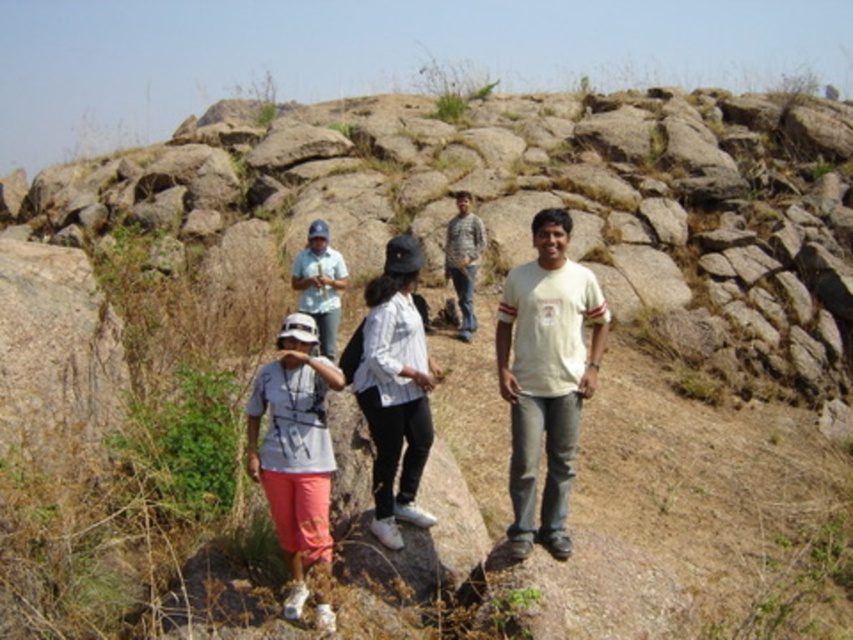
Does white matte shirt at center have a larger size compared to matte white shirt at center?

Correct, white matte shirt at center is larger in size than matte white shirt at center.

Who is lower down, white matte shirt at center or matte white shirt at center?

Positioned lower is white matte shirt at center.

Which is behind, point (410, 387) or point (339, 259)?

Positioned behind is point (339, 259).

Locate an element on the screen. The image size is (853, 640). white matte shirt at center is located at coordinates (395, 388).

Which is behind, point (503, 323) or point (374, 529)?

Point (503, 323)

Is white cotton t-shirt at center positioned at the back of white matte shirt at center?

No.

Who is more distant from viewer, [546,456] or [384,289]?

The point [384,289] is behind.

Where is `white cotton t-shirt at center`? white cotton t-shirt at center is located at coordinates (546, 376).

Can you confirm if matte white shirt at center is positioned to the left of camouflage fabric shirt at center?

Indeed, matte white shirt at center is positioned on the left side of camouflage fabric shirt at center.

Is matte white shirt at center taller than camouflage fabric shirt at center?

No.

The image size is (853, 640). What do you see at coordinates (320, 284) in the screenshot?
I see `matte white shirt at center` at bounding box center [320, 284].

Locate an element on the screen. Image resolution: width=853 pixels, height=640 pixels. matte white shirt at center is located at coordinates (320, 284).